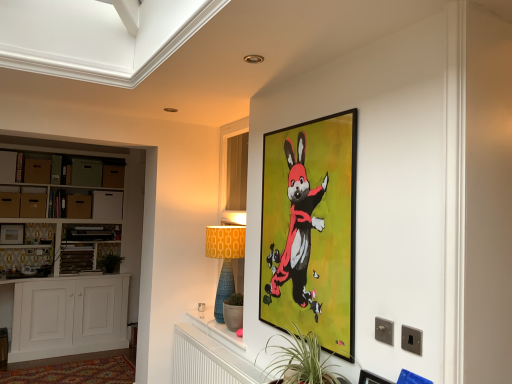
Question: Can you confirm if matte brown drawer at left, the sixth drawer from the right, is wider than white wood cabinet at left, which is counted as the second cabinetry, starting from the top?

Choices:
 (A) yes
 (B) no

Answer: (B)

Question: From the image's perspective, would you say matte brown drawer at left, acting as the 2th drawer starting from the left, is positioned over white wood cabinet at left, the 1th cabinetry when ordered from bottom to top?

Choices:
 (A) yes
 (B) no

Answer: (A)

Question: Are matte brown drawer at left, the sixth drawer from the right, and white wood cabinet at left, the 1th cabinetry when ordered from bottom to top, located far from each other?

Choices:
 (A) no
 (B) yes

Answer: (B)

Question: Is matte brown drawer at left, the sixth drawer from the right, further to camera compared to white wood cabinet at left, which is counted as the second cabinetry, starting from the top?

Choices:
 (A) no
 (B) yes

Answer: (B)

Question: From a real-world perspective, is matte brown drawer at left, the sixth drawer from the right, beneath white wood cabinet at left, which is counted as the second cabinetry, starting from the top?

Choices:
 (A) no
 (B) yes

Answer: (A)

Question: Is matte brown drawer at left, the sixth drawer from the right, bigger than white wood cabinet at left, the 1th cabinetry when ordered from bottom to top?

Choices:
 (A) yes
 (B) no

Answer: (B)

Question: Are matte brown drawer at left, acting as the 1th drawer starting from the left, and matte black picture frame at upper right, positioned as the first picture frame in right-to-left order, making contact?

Choices:
 (A) no
 (B) yes

Answer: (A)

Question: Is matte brown drawer at left, which is the 7th drawer in right-to-left order, located outside matte black picture frame at upper right, the 3th picture frame viewed from the back?

Choices:
 (A) no
 (B) yes

Answer: (B)

Question: Is the depth of matte brown drawer at left, acting as the 1th drawer starting from the left, greater than that of matte black picture frame at upper right, positioned as the first picture frame in right-to-left order?

Choices:
 (A) yes
 (B) no

Answer: (A)

Question: Can you confirm if matte brown drawer at left, which is the 7th drawer in right-to-left order, is bigger than matte black picture frame at upper right, arranged as the 1th picture frame when viewed from the front?

Choices:
 (A) yes
 (B) no

Answer: (A)

Question: From a real-world perspective, is matte brown drawer at left, acting as the 1th drawer starting from the left, below matte black picture frame at upper right, positioned as the first picture frame in right-to-left order?

Choices:
 (A) no
 (B) yes

Answer: (A)

Question: Does matte brown drawer at left, which is the 7th drawer in right-to-left order, have a greater height compared to matte black picture frame at upper right, the 3th picture frame viewed from the back?

Choices:
 (A) yes
 (B) no

Answer: (A)

Question: From a real-world perspective, is white wood cabinet at left, which is counted as the second cabinetry, starting from the top, on top of matte black picture frame at upper right, positioned as the first picture frame in right-to-left order?

Choices:
 (A) yes
 (B) no

Answer: (B)